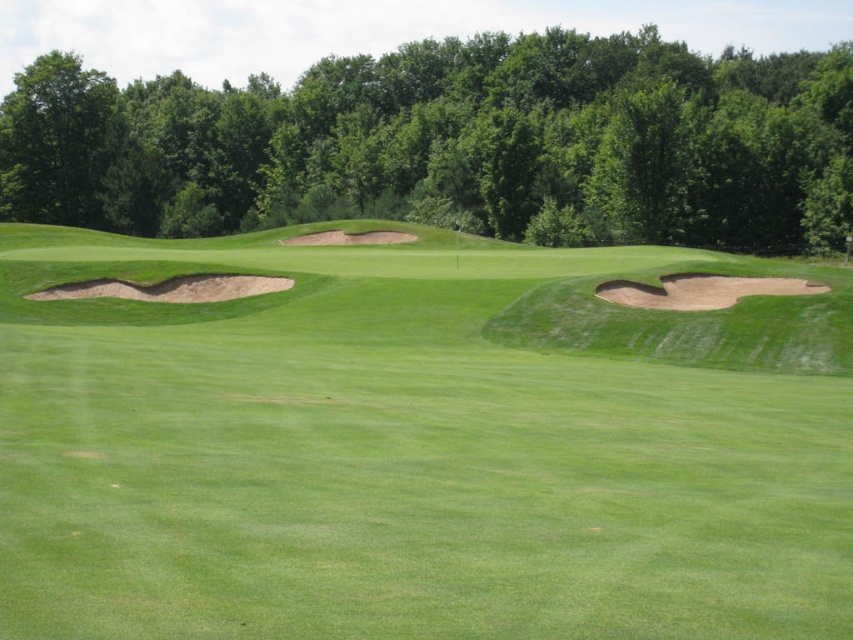
You are a golfer standing on the green grassy fairway at center and want to hit your ball into the sandy brown sand trap at left. Considering their sizes, which area will require more force to cover the distance?

The green grassy fairway at center has a larger size compared to the sandy brown sand trap at left, so you need to apply more force to reach the sandy brown sand trap at left from the green grassy fairway at center because it is farther away.

You are standing at the origin point of the golf course map. The green grassy fairway at center is marked at coordinates 0.698, 0.491. If you want to reach the fairway, which direction should you move relative to your current position?

The green grassy fairway at center is located at coordinates (418, 445), so you should move northeast to reach it since the coordinates indicate a position that is both east and north from the origin.

You are a golfer standing at the tee box and want to hit the ball to the green. There are two points marked on the course, point A at coordinates point (814, 592) and point B at coordinates point (640, 106). Which point is closer to your current position?

Point A at coordinates point (814, 592) is closer to the camera than point B at coordinates point (640, 106), so the golfer is closer to point A.